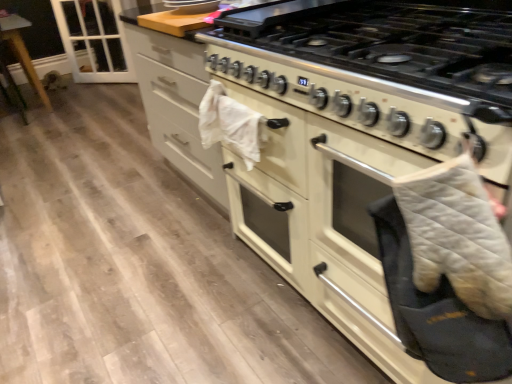
Question: From a real-world perspective, is white glossy gas stove at center positioned under gray quilted oven mitt at right based on gravity?

Choices:
 (A) yes
 (B) no

Answer: (B)

Question: Is white glossy gas stove at center not within gray quilted oven mitt at right?

Choices:
 (A) yes
 (B) no

Answer: (A)

Question: Is white glossy gas stove at center thinner than gray quilted oven mitt at right?

Choices:
 (A) no
 (B) yes

Answer: (A)

Question: Is white glossy gas stove at center bigger than gray quilted oven mitt at right?

Choices:
 (A) yes
 (B) no

Answer: (A)

Question: Is white glossy gas stove at center at the left side of gray quilted oven mitt at right?

Choices:
 (A) yes
 (B) no

Answer: (B)

Question: Is transparent glass door at upper left spatially inside gray quilted oven mitt at right, or outside of it?

Choices:
 (A) inside
 (B) outside

Answer: (B)

Question: Is transparent glass door at upper left taller or shorter than gray quilted oven mitt at right?

Choices:
 (A) short
 (B) tall

Answer: (B)

Question: From a real-world perspective, is transparent glass door at upper left above or below gray quilted oven mitt at right?

Choices:
 (A) above
 (B) below

Answer: (B)

Question: From the image's perspective, is transparent glass door at upper left positioned above or below gray quilted oven mitt at right?

Choices:
 (A) below
 (B) above

Answer: (B)

Question: From the image's perspective, is white glossy gas stove at center above or below transparent glass door at upper left?

Choices:
 (A) above
 (B) below

Answer: (B)

Question: Looking at their shapes, would you say white glossy gas stove at center is wider or thinner than transparent glass door at upper left?

Choices:
 (A) wide
 (B) thin

Answer: (A)

Question: Considering the relative positions of white glossy gas stove at center and transparent glass door at upper left in the image provided, is white glossy gas stove at center to the left or to the right of transparent glass door at upper left?

Choices:
 (A) right
 (B) left

Answer: (A)

Question: Considering their positions, is white glossy gas stove at center located in front of or behind transparent glass door at upper left?

Choices:
 (A) behind
 (B) front

Answer: (B)

Question: From the image's perspective, is gray quilted oven mitt at right located above or below transparent glass door at upper left?

Choices:
 (A) above
 (B) below

Answer: (B)

Question: Is gray quilted oven mitt at right to the left or to the right of transparent glass door at upper left in the image?

Choices:
 (A) right
 (B) left

Answer: (A)